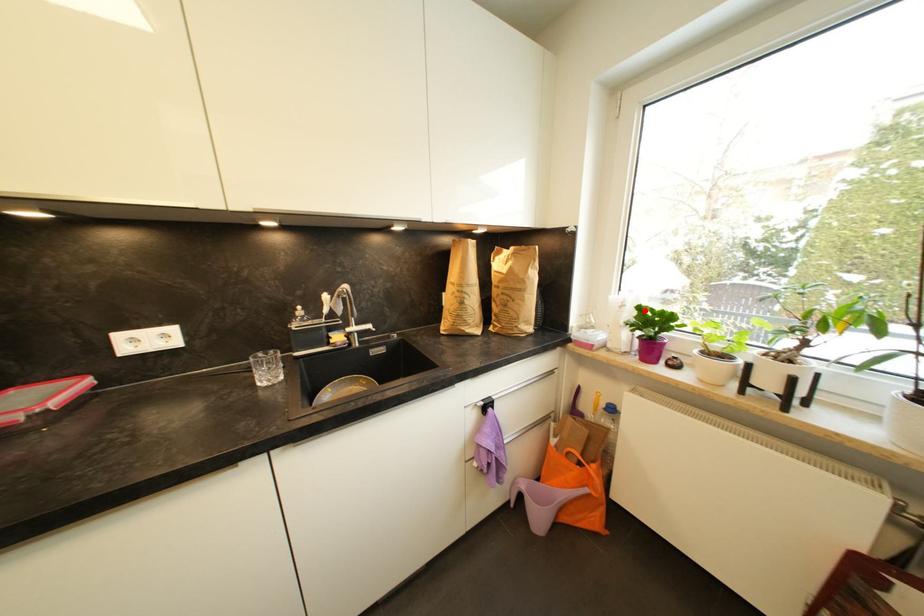
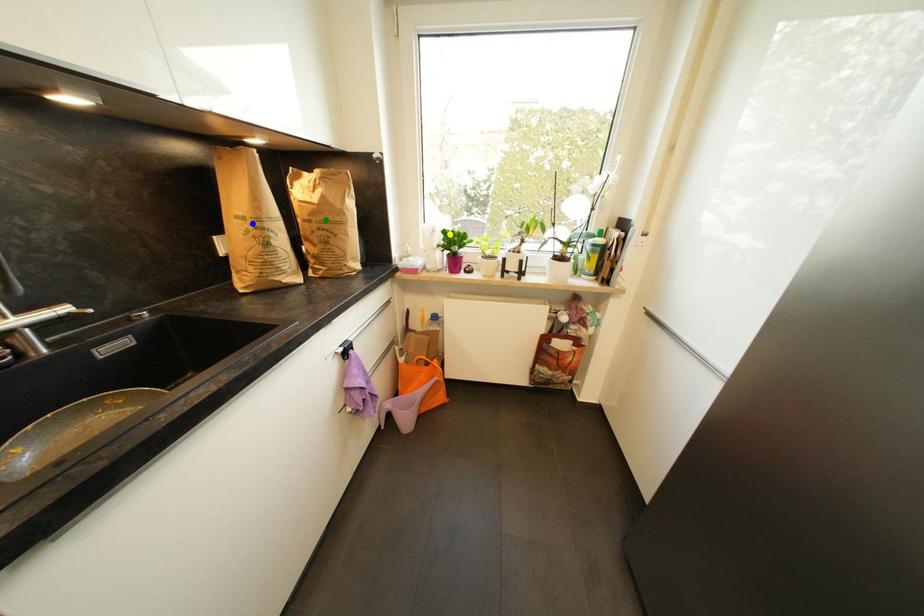
Question: I am providing you with two images of the same scene from different viewpoints. A red point is marked on the first image. You are given multiple points on the second image. Which point in image 2 is actually the same real-world point as the red point in image 1?

Choices:
 (A) green point
 (B) blue point
 (C) yellow point

Answer: (C)